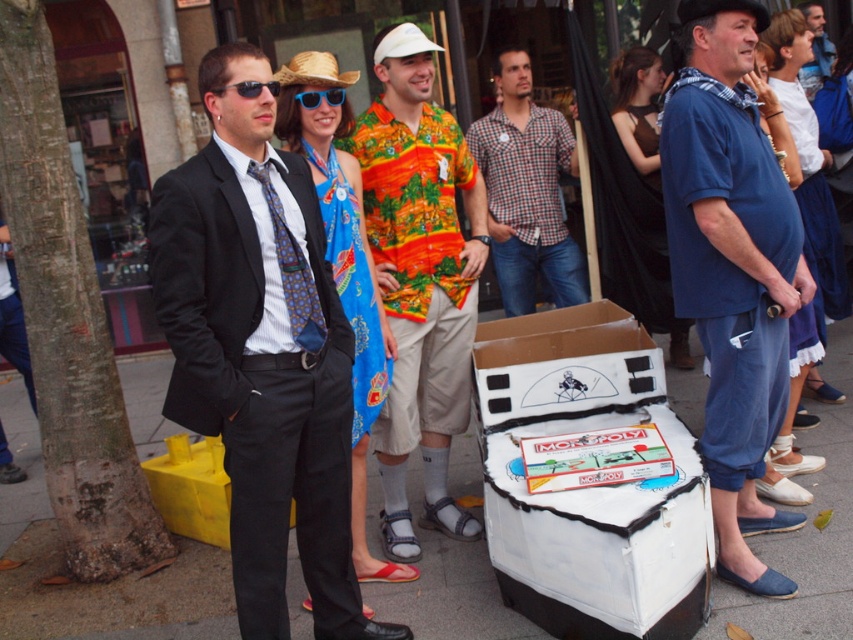
Locate an element on the screen. This screenshot has height=640, width=853. printed cotton shirt at center is located at coordinates (421, 278).

Is point (448, 369) behind point (242, 81)?

That is True.

Identify the location of printed cotton shirt at center. The image size is (853, 640). (421, 278).

Can you confirm if white cardboard monopoly box at lower center is shorter than black plastic sunglasses at upper center?

No, white cardboard monopoly box at lower center is not shorter than black plastic sunglasses at upper center.

Does white cardboard monopoly box at lower center have a greater width compared to black plastic sunglasses at upper center?

Yes.

Who is more distant from viewer, (556, 355) or (254, 93)?

The point (556, 355) is behind.

In order to click on white cardboard monopoly box at lower center in this screenshot , I will do `click(589, 488)`.

Is white cardboard box at center wider than blue plastic sunglasses at center?

Yes.

Is white cardboard box at center closer to the viewer compared to blue plastic sunglasses at center?

Yes.

Does point (183, 598) come in front of point (312, 104)?

No.

This screenshot has width=853, height=640. Identify the location of white cardboard box at center. (96, 582).